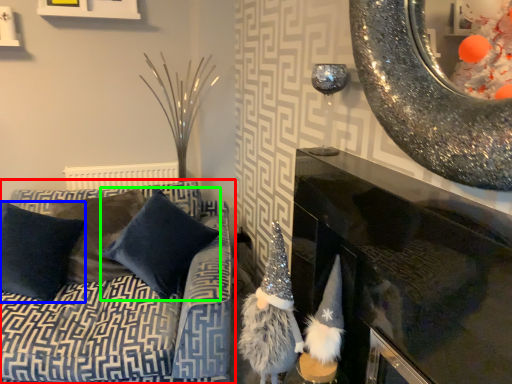
Question: Which object is the farthest from studio couch (highlighted by a red box)? Choose among these: pillow (highlighted by a blue box) or pillow (highlighted by a green box).

Choices:
 (A) pillow
 (B) pillow

Answer: (A)